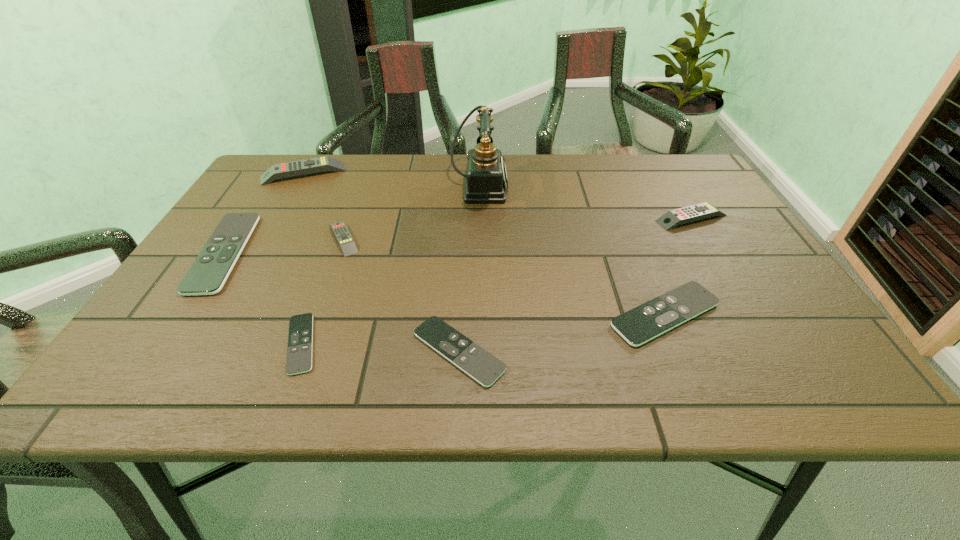
I want to click on gray telephone, so click(486, 177).

At what (x,y) coordinates should I click in order to perform the action: click on telephone. Please return your answer as a coordinate pair (x, y). The image size is (960, 540). Looking at the image, I should click on (486, 177).

Locate an element on the screen. the leftmost yellow remote control is located at coordinates (308, 166).

What are the coordinates of `the tallest remote control` in the screenshot? It's located at (308, 166).

The width and height of the screenshot is (960, 540). In order to click on the third tallest object in this screenshot , I will do pyautogui.click(x=672, y=218).

Locate an element on the screen. This screenshot has width=960, height=540. the rightmost yellow remote control is located at coordinates (672, 218).

Identify the location of the fifth shortest remote control. Image resolution: width=960 pixels, height=540 pixels. (340, 230).

Find the location of `the fifth shortest object`. the fifth shortest object is located at coordinates (340, 230).

Find the location of a particular element. This screenshot has height=540, width=960. the fourth tallest remote control is located at coordinates (207, 275).

Where is `the fourth shortest object`? Image resolution: width=960 pixels, height=540 pixels. the fourth shortest object is located at coordinates (207, 275).